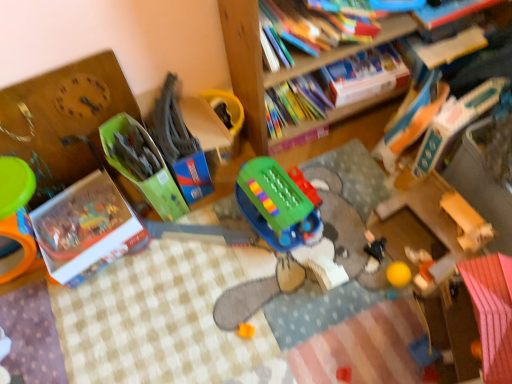
What are the coordinates of `free space in front of black plastic toy at center, positioned as the fifth toy in left-to-right order` in the screenshot? It's located at (389, 289).